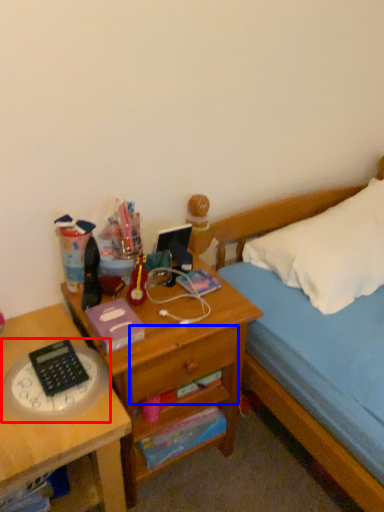
Question: Which of the following is the closest to the observer, clock (highlighted by a red box) or drawer (highlighted by a blue box)?

Choices:
 (A) clock
 (B) drawer

Answer: (A)